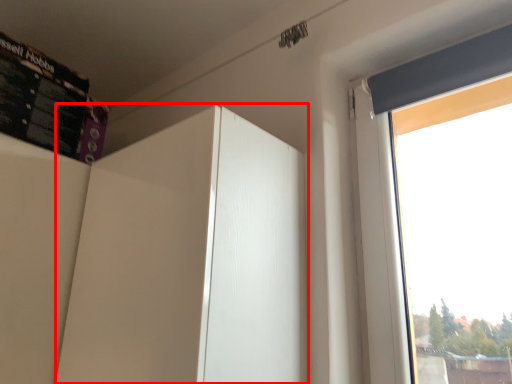
Question: Where is screen door (annotated by the red box) located in relation to bulletin board in the image?

Choices:
 (A) left
 (B) right

Answer: (B)